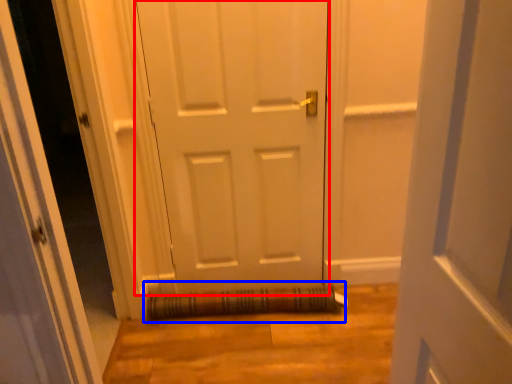
Question: Which of the following is the farthest to the observer, door (highlighted by a red box) or doormat (highlighted by a blue box)?

Choices:
 (A) door
 (B) doormat

Answer: (B)